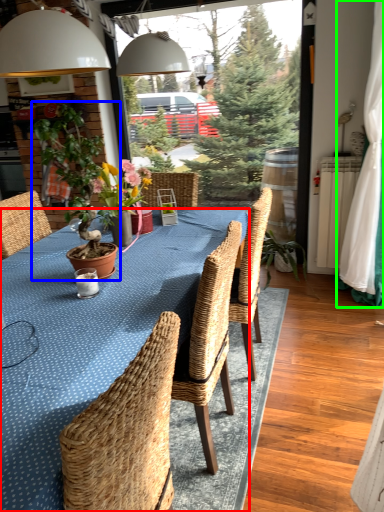
Question: Which object is positioned closest to kitchen & dining room table (highlighted by a red box)? Select from houseplant (highlighted by a blue box) and curtain (highlighted by a green box).

Choices:
 (A) houseplant
 (B) curtain

Answer: (A)